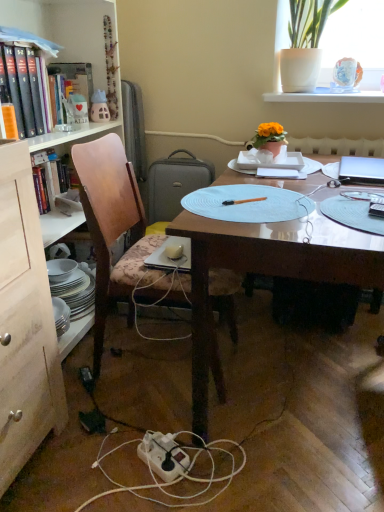
Where is `vacant space in front of wooden chair at left`? Image resolution: width=384 pixels, height=512 pixels. vacant space in front of wooden chair at left is located at coordinates (137, 452).